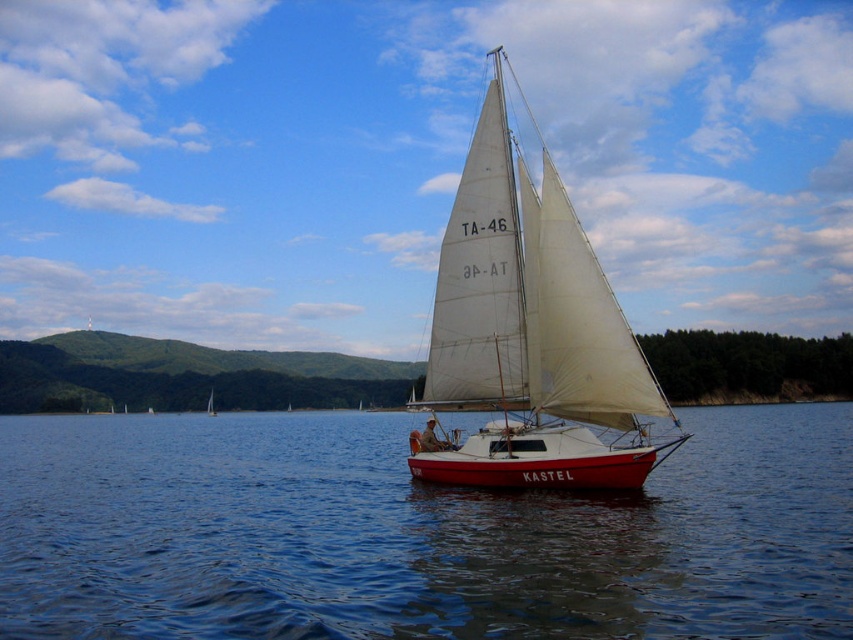
You are an observer standing on the shore looking at the sailboat named KASTEL. You notice the smooth blue water at center and the white sailboat at center. Which object is positioned higher from your viewpoint?

The smooth blue water at center is located above the white sailboat at center, so it is positioned higher from your viewpoint.

You are a photographer trying to capture the white canvas sailboat at center and the white sailboat at center in a single shot. Given that your camera has a fixed focal length, which boat should you position closer to the center of the frame to ensure both are fully visible?

You should position the white sailboat at center closer to the center of the frame because it is narrower than the white canvas sailboat at center, allowing more space for both to fit within the camera shot.

You are standing on the deck of the sailboat named KASTEL and want to jump into the water. The smooth blue water at center is the closest point to you. Is the distance safe for a jump?

The smooth blue water at center is 36.94 feet from viewer, which is a safe distance for jumping in.